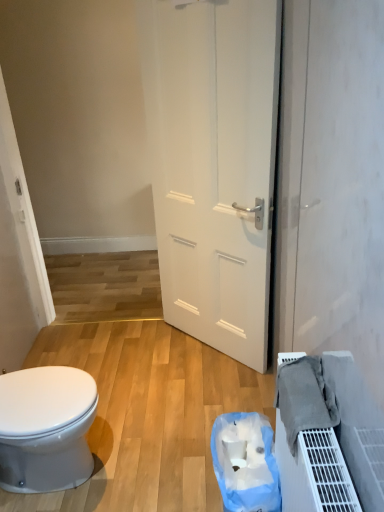
Locate an element on the screen. The height and width of the screenshot is (512, 384). vacant area that lies between white glossy bidet at lower left and white matte door at center is located at coordinates (162, 392).